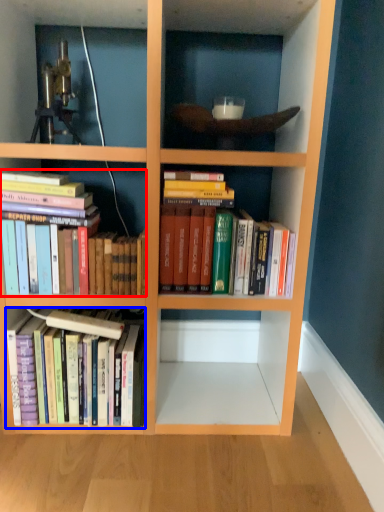
Question: Which point is further to the camera, book (highlighted by a red box) or book (highlighted by a blue box)?

Choices:
 (A) book
 (B) book

Answer: (B)